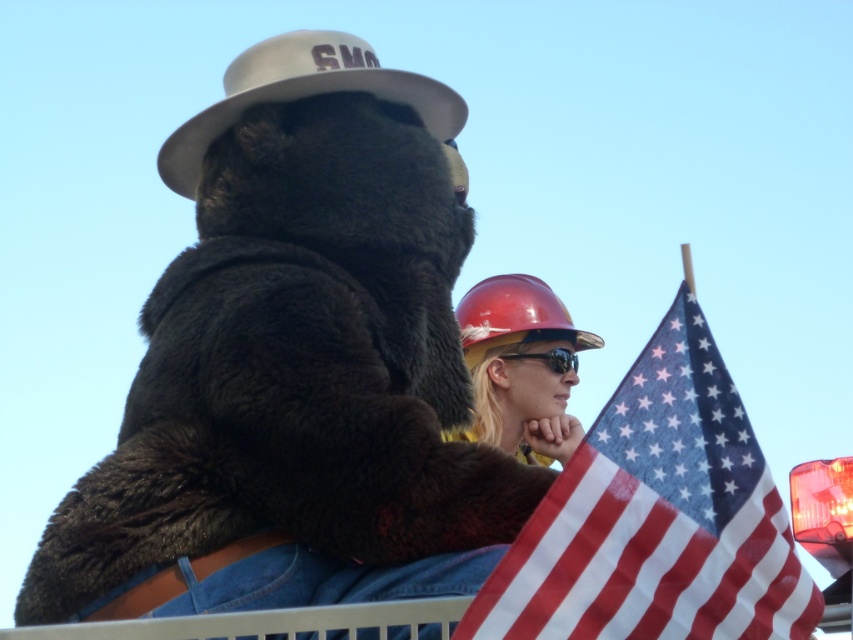
Which of these two, hard hat at upper center or black plastic goggles at center, stands taller?

With more height is hard hat at upper center.

Does hard hat at upper center have a lesser height compared to black plastic goggles at center?

Incorrect, hard hat at upper center's height does not fall short of black plastic goggles at center's.

Is point (280, 280) less distant than point (512, 355)?

Yes.

I want to click on hard hat at upper center, so click(296, 365).

Between point (251, 241) and point (555, 604), which one is positioned in front?

Positioned in front is point (555, 604).

What do you see at coordinates (296, 365) in the screenshot?
I see `hard hat at upper center` at bounding box center [296, 365].

The image size is (853, 640). I want to click on hard hat at upper center, so click(x=296, y=365).

Who is higher up, hard hat at upper center or shiny red hard hat at center?

Positioned higher is hard hat at upper center.

Who is taller, hard hat at upper center or shiny red hard hat at center?

hard hat at upper center

Locate an element on the screen. hard hat at upper center is located at coordinates (296, 365).